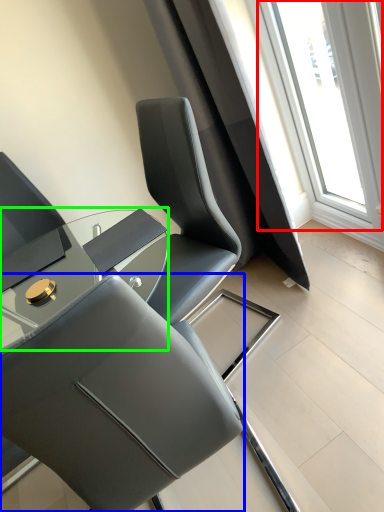
Question: Which is nearer to the window (highlighted by a red box)? chair (highlighted by a blue box) or table (highlighted by a green box).

Choices:
 (A) chair
 (B) table

Answer: (B)